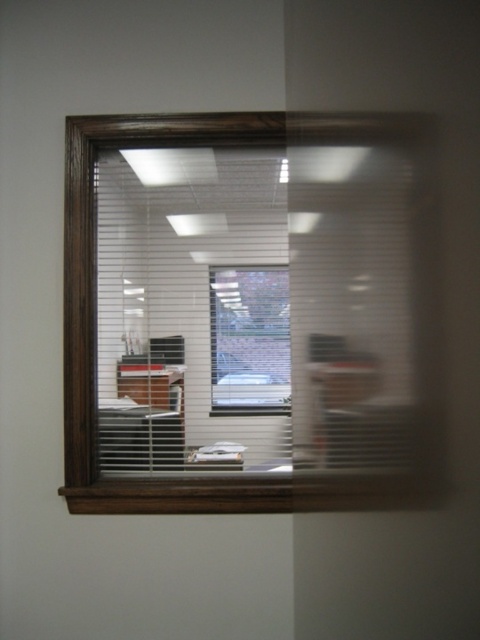
Question: Which of the following is the closest to the observer?

Choices:
 (A) white matte blinds at center
 (B) brick wall at center

Answer: (A)

Question: Is white matte blinds at center to the right of brick wall at center from the viewer's perspective?

Choices:
 (A) yes
 (B) no

Answer: (B)

Question: Where is white matte blinds at center located in relation to brick wall at center in the image?

Choices:
 (A) below
 (B) above

Answer: (B)

Question: Can you confirm if white matte blinds at center is thinner than brick wall at center?

Choices:
 (A) yes
 (B) no

Answer: (B)